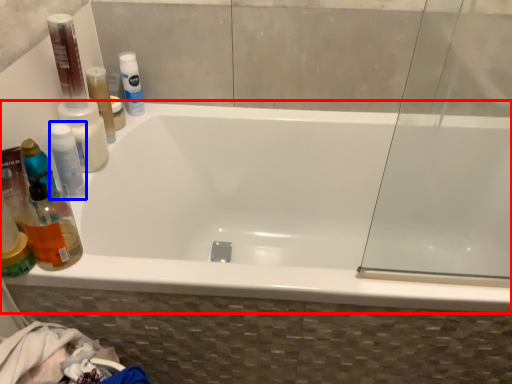
Question: Among these objects, which one is nearest to the camera, bathtub (highlighted by a red box) or mouthwash (highlighted by a blue box)?

Choices:
 (A) bathtub
 (B) mouthwash

Answer: (A)